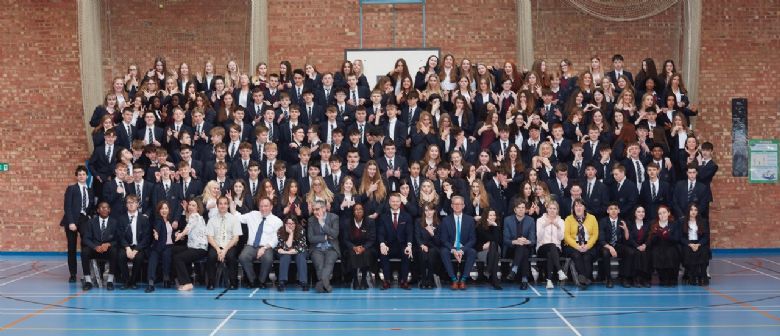
At what (x,y) coordinates should I click in order to perform the action: click on drapery. Please return your answer as a coordinate pair (x, y). This screenshot has width=780, height=336. Looking at the image, I should click on (90, 22), (254, 32), (520, 33), (693, 54).